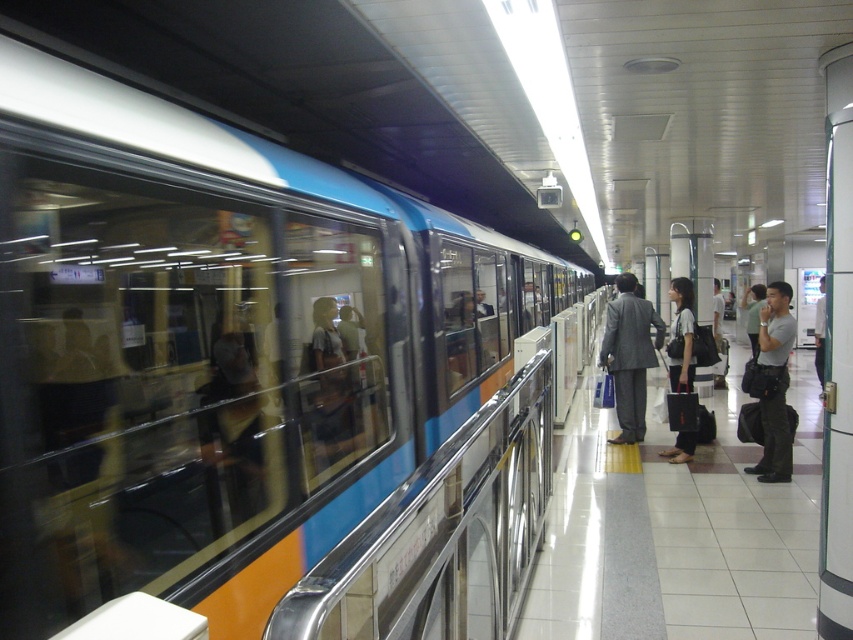
Question: Which of the following is the closest to the observer?

Choices:
 (A) gray fabric bag at right
 (B) matte black bag at center
 (C) matte gray suit at center

Answer: (A)

Question: Which of the following is the farthest from the observer?

Choices:
 (A) matte gray suit at center
 (B) matte black bag at center
 (C) gray fabric bag at right

Answer: (A)

Question: Can you confirm if matte gray suit at center is bigger than gray fabric bag at right?

Choices:
 (A) no
 (B) yes

Answer: (B)

Question: Does matte gray suit at center have a smaller size compared to matte black bag at center?

Choices:
 (A) yes
 (B) no

Answer: (B)

Question: Among these objects, which one is nearest to the camera?

Choices:
 (A) gray fabric bag at right
 (B) matte black bag at center
 (C) matte gray suit at center

Answer: (A)

Question: Is matte gray suit at center smaller than matte black bag at center?

Choices:
 (A) no
 (B) yes

Answer: (A)